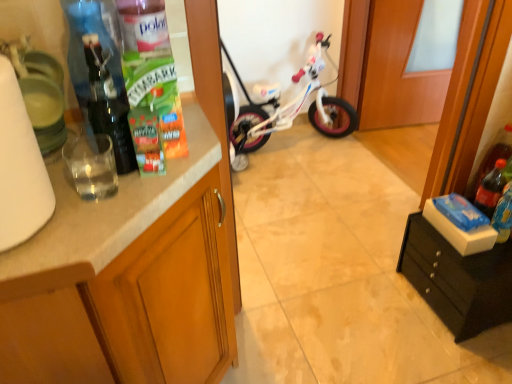
Question: From the image's perspective, does white glossy bicycle at center appear higher than matte wood cabinet at left, which ranks as the first cabinetry in left-to-right order?

Choices:
 (A) yes
 (B) no

Answer: (A)

Question: From the image's perspective, is white glossy bicycle at center under matte wood cabinet at left, the second cabinetry in the right-to-left sequence?

Choices:
 (A) no
 (B) yes

Answer: (A)

Question: From a real-world perspective, does white glossy bicycle at center sit lower than matte wood cabinet at left, which ranks as the first cabinetry in left-to-right order?

Choices:
 (A) yes
 (B) no

Answer: (A)

Question: Is white glossy bicycle at center next to matte wood cabinet at left, which ranks as the first cabinetry in left-to-right order, and touching it?

Choices:
 (A) no
 (B) yes

Answer: (A)

Question: Does white glossy bicycle at center turn towards matte wood cabinet at left, the second cabinetry in the right-to-left sequence?

Choices:
 (A) yes
 (B) no

Answer: (A)

Question: From the image's perspective, is white matte paper towel at left above or below white marble countertop at left?

Choices:
 (A) above
 (B) below

Answer: (A)

Question: In the image, is white matte paper towel at left on the left side or the right side of white marble countertop at left?

Choices:
 (A) left
 (B) right

Answer: (A)

Question: In the image, is white matte paper towel at left positioned in front of or behind white marble countertop at left?

Choices:
 (A) behind
 (B) front

Answer: (B)

Question: Choose the correct answer: Is white matte paper towel at left inside white marble countertop at left or outside it?

Choices:
 (A) outside
 (B) inside

Answer: (A)

Question: Is white marble countertop at left to the left or to the right of blue cardboard box at right in the image?

Choices:
 (A) right
 (B) left

Answer: (B)

Question: Relative to blue cardboard box at right, is white marble countertop at left in front or behind?

Choices:
 (A) front
 (B) behind

Answer: (A)

Question: Is point (105, 226) closer or farther from the camera than point (458, 200)?

Choices:
 (A) closer
 (B) farther

Answer: (A)

Question: Is white marble countertop at left taller or shorter than blue cardboard box at right?

Choices:
 (A) short
 (B) tall

Answer: (A)

Question: Would you say white matte paper towel at left is to the left or to the right of matte wood cabinet at left, the second cabinetry in the right-to-left sequence, in the picture?

Choices:
 (A) left
 (B) right

Answer: (A)

Question: Does point (46, 178) appear closer or farther from the camera than point (78, 339)?

Choices:
 (A) closer
 (B) farther

Answer: (A)